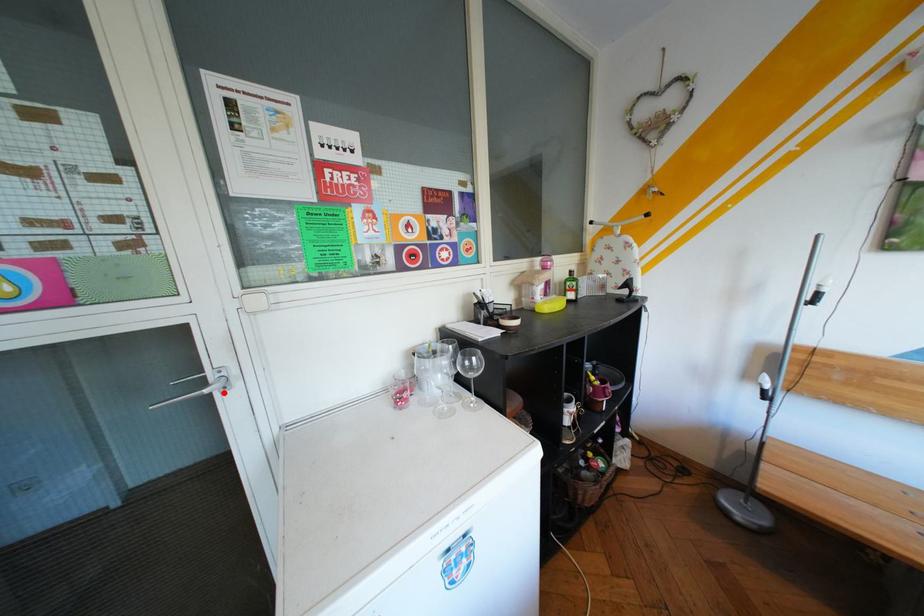
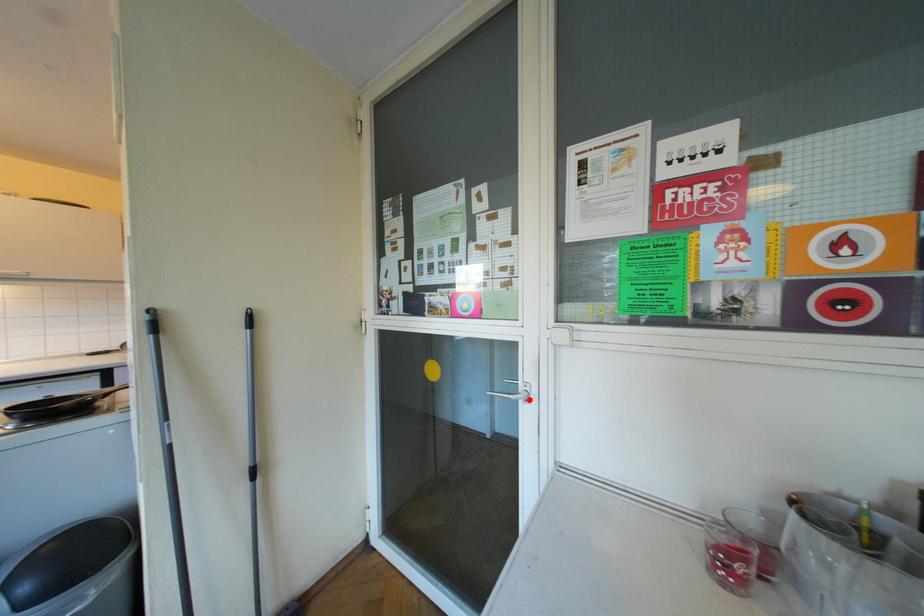
I am providing you with two images of the same scene from different viewpoints. A red point is marked on the first image and another point is marked on the second image. Do the highlighted points in image1 and image2 indicate the same real-world spot?

Yes